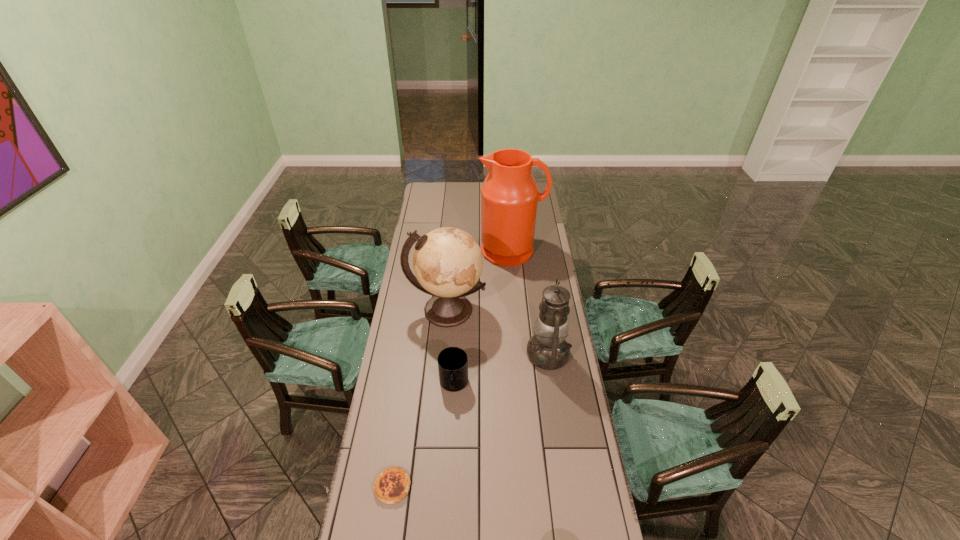
Image resolution: width=960 pixels, height=540 pixels. What are the coordinates of `water jug` in the screenshot? It's located at (509, 195).

Image resolution: width=960 pixels, height=540 pixels. In order to click on the tallest object in this screenshot , I will do pos(509,195).

This screenshot has height=540, width=960. Identify the location of globe. (447, 262).

Where is `oil lamp`? This screenshot has height=540, width=960. oil lamp is located at coordinates (547, 349).

Where is `mug`? The width and height of the screenshot is (960, 540). mug is located at coordinates (453, 361).

The image size is (960, 540). I want to click on the shortest object, so click(x=392, y=485).

Locate an element on the screen. The image size is (960, 540). the nearest object is located at coordinates (392, 485).

Find the location of `free space located from the spout of the water jug`. free space located from the spout of the water jug is located at coordinates (517, 314).

Find the location of `vacant space situated on the front-facing side of the globe`. vacant space situated on the front-facing side of the globe is located at coordinates (443, 362).

Find the location of a particular element. The image size is (960, 540). free point located 0.170m on the front of the oil lamp is located at coordinates (558, 417).